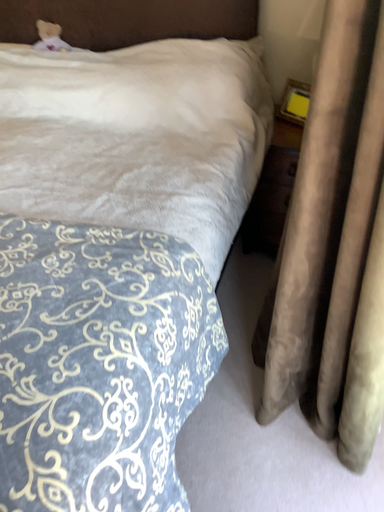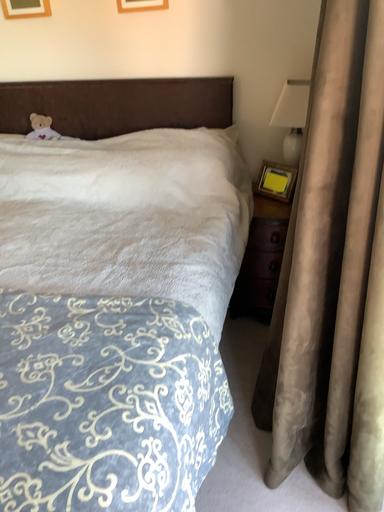
Question: Which way did the camera rotate in the video?

Choices:
 (A) rotated downward
 (B) rotated upward

Answer: (B)